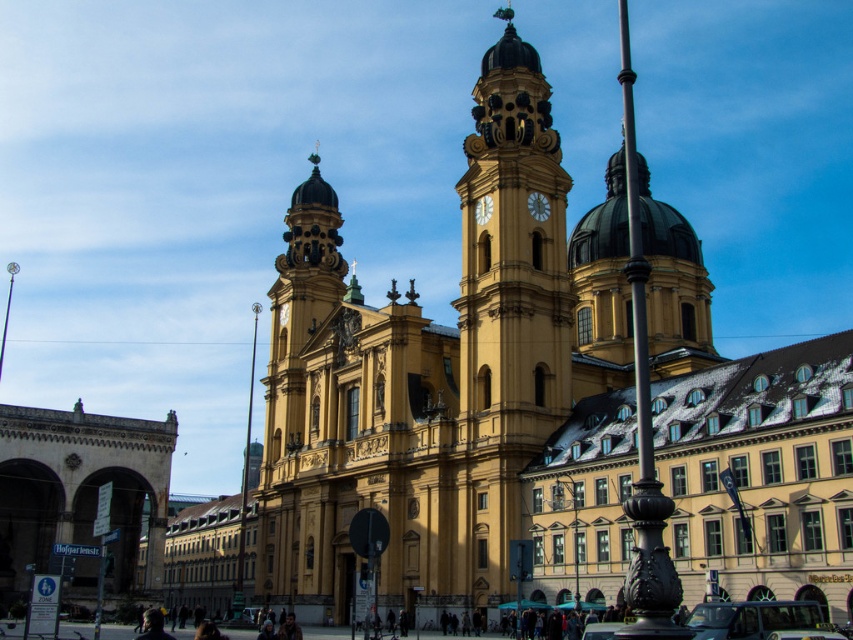
You are standing on the street in front of the grand historic building. You notice the yellow stone clock tower at center and the metallic gold clock at center. Which object is positioned higher up on the building?

The metallic gold clock at center is positioned higher up on the building since the yellow stone clock tower at center is located below it.